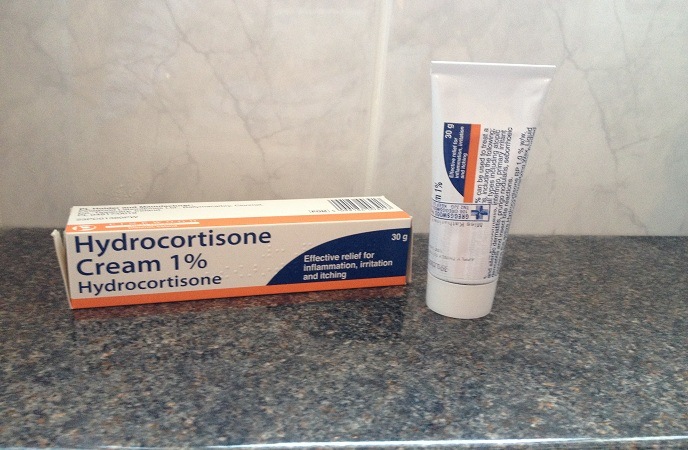
This screenshot has width=688, height=450. What are the coordinates of `marble` in the screenshot? It's located at (246, 113).